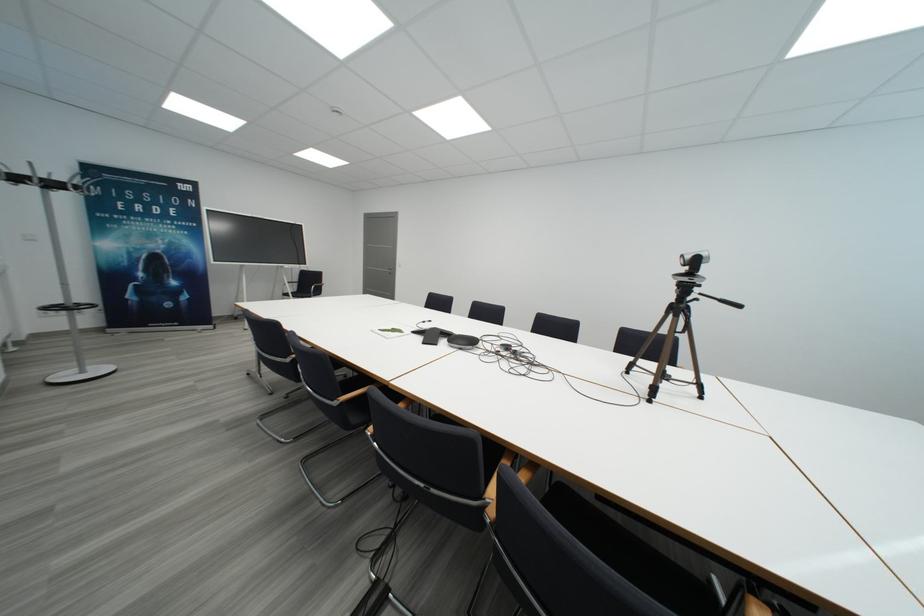
Locate an element on the screen. This screenshot has height=616, width=924. tripod pan handle is located at coordinates (723, 301).